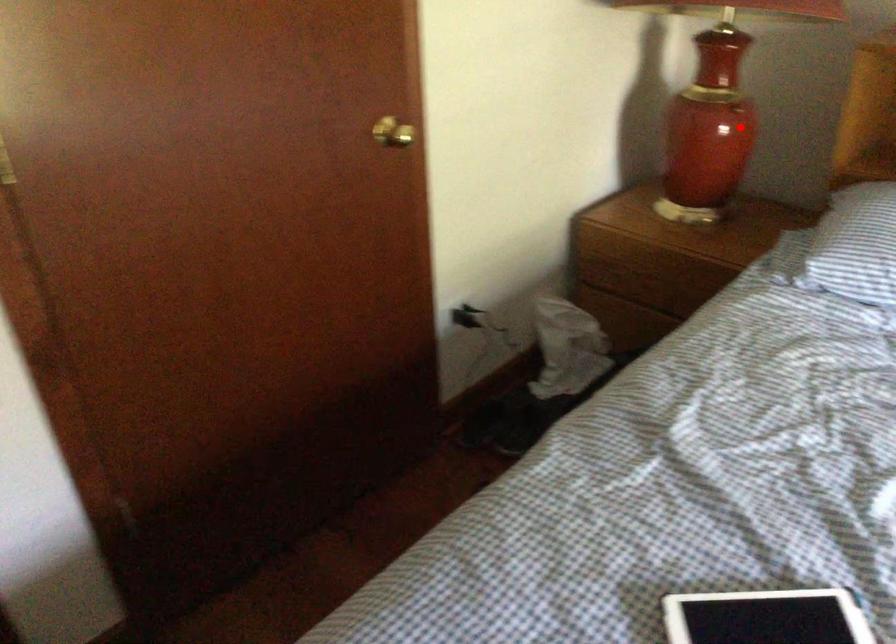
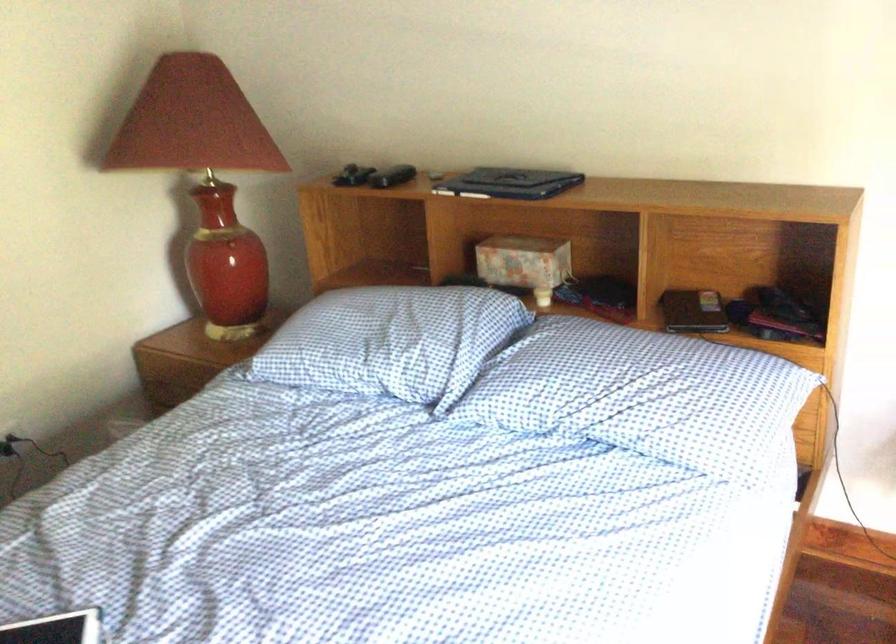
Question: I am providing you with two images of the same scene from different viewpoints. Image1 has a red point marked. In image2, the corresponding 3D location appears at what relative position? Reply with the corresponding letter.

Choices:
 (A) Closer
 (B) Farther

Answer: (B)